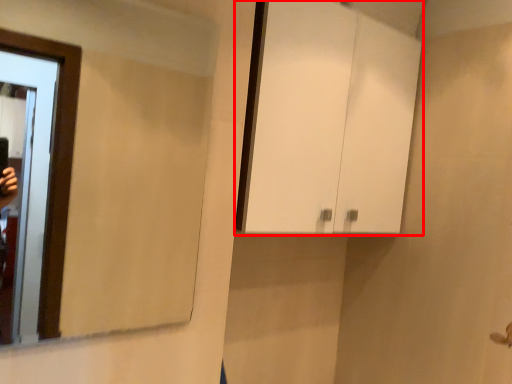
Question: From the image's perspective, what is the correct spatial relationship of cabinetry (annotated by the red box) in relation to mirror?

Choices:
 (A) below
 (B) above

Answer: (B)